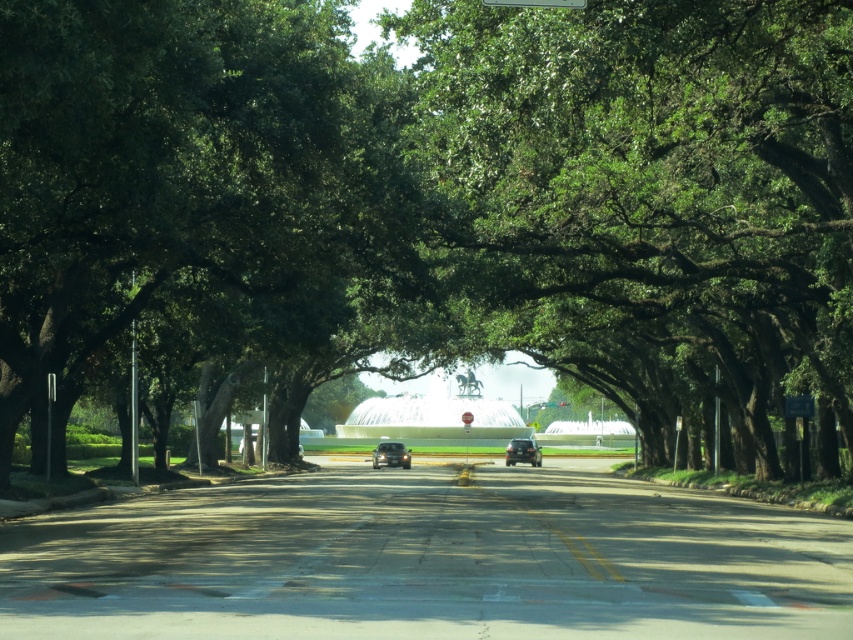
Between point (389, 442) and point (520, 454), which one is positioned behind?

The point (520, 454) is behind.

Which is more to the right, shiny silver sedan at center or shiny black car at center?

shiny black car at center is more to the right.

Which is in front, point (372, 460) or point (532, 442)?

Positioned in front is point (372, 460).

In order to click on shiny silver sedan at center in this screenshot , I will do `click(390, 454)`.

You are a GUI agent. You are given a task and a screenshot of the screen. Output one action in this format:
    pyautogui.click(x=<x>, y=<y>)
    Task: Click on the green leafy tree at center
    This screenshot has width=853, height=640.
    Given the screenshot: What is the action you would take?
    pyautogui.click(x=653, y=202)

Between point (653, 188) and point (567, 1), which one is positioned in front?

Point (567, 1)

This screenshot has width=853, height=640. What are the coordinates of `green leafy tree at center` in the screenshot? It's located at (653, 202).

Between shiny black car at center and green plastic street sign at upper center, which one has less height?

green plastic street sign at upper center is shorter.

Is point (515, 449) farther from viewer compared to point (582, 4)?

Yes, point (515, 449) is farther from viewer.

Where is `shiny black car at center`? shiny black car at center is located at coordinates (521, 451).